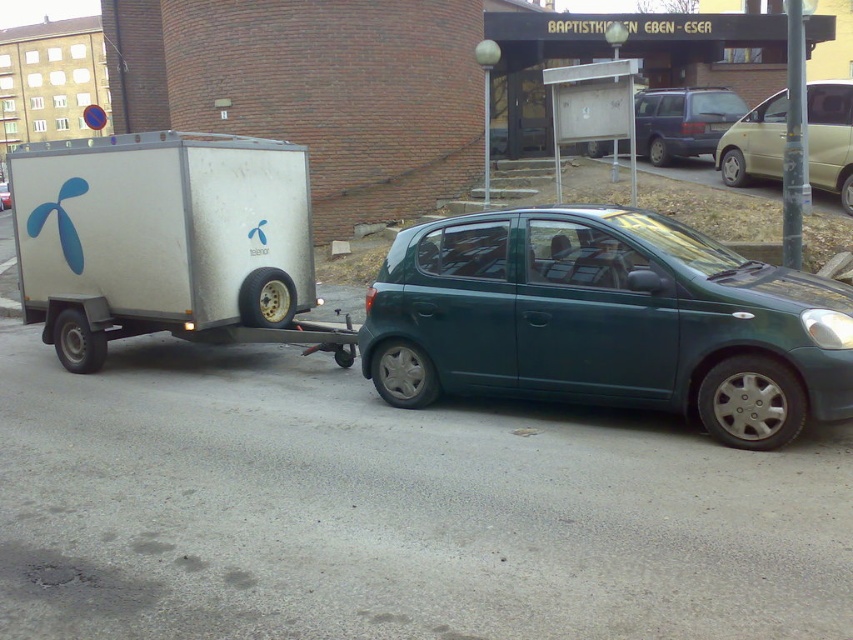
Is point (51, 282) positioned after point (747, 118)?

That is False.

Between silver metallic trailer at left and metallic gold minivan at right, which one has less height?

With less height is silver metallic trailer at left.

Where is `silver metallic trailer at left`? silver metallic trailer at left is located at coordinates (166, 243).

The height and width of the screenshot is (640, 853). Identify the location of silver metallic trailer at left. (166, 243).

From the picture: Between green matte car at center and matte gray van at center, which one appears on the left side from the viewer's perspective?

Positioned to the left is green matte car at center.

Is green matte car at center shorter than matte gray van at center?

Yes.

Is point (671, 282) farther from viewer compared to point (672, 106)?

No, (671, 282) is closer to viewer.

Locate an element on the screen. green matte car at center is located at coordinates 607,321.

Who is shorter, metallic gold minivan at right or matte gray van at center?

metallic gold minivan at right is shorter.

Between metallic gold minivan at right and matte gray van at center, which one has more height?

Result: Standing taller between the two is matte gray van at center.

The height and width of the screenshot is (640, 853). I want to click on metallic gold minivan at right, so click(830, 138).